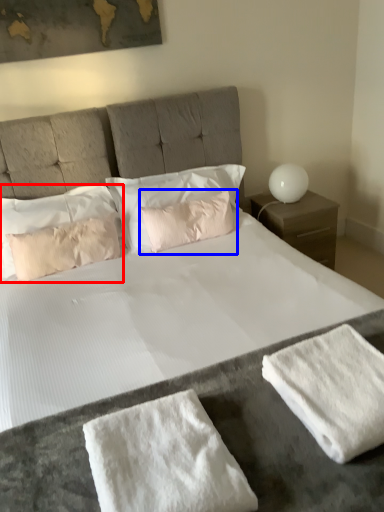
Question: Which of the following is the farthest to the observer, pillow (highlighted by a red box) or pillow (highlighted by a blue box)?

Choices:
 (A) pillow
 (B) pillow

Answer: (B)